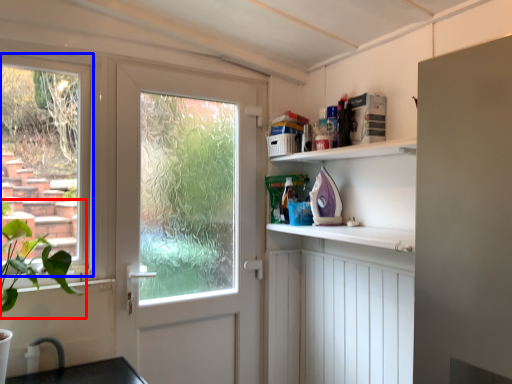
Question: Which object appears farthest to the camera in this image, plant (highlighted by a red box) or window (highlighted by a blue box)?

Choices:
 (A) plant
 (B) window

Answer: (B)